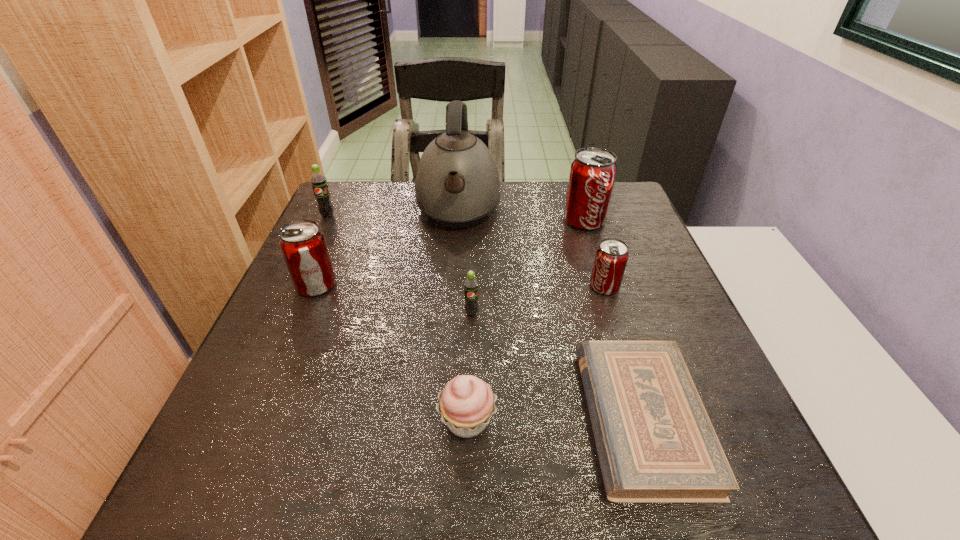
Identify the location of pink cupcake. (466, 404).

Locate an element on the screen. Bible is located at coordinates (655, 442).

You are a GUI agent. You are given a task and a screenshot of the screen. Output one action in this format:
    pyautogui.click(x=<x>, y=<y>)
    Task: Click on the blue Bible
    Image resolution: width=960 pixels, height=540 pixels.
    Given the screenshot: What is the action you would take?
    pyautogui.click(x=655, y=442)

I want to click on vacant space situated at the spout of the kettle, so (x=453, y=284).

What are the coordinates of `vacant space located 0.140m on the back of the tallest soda` in the screenshot? It's located at (573, 185).

I want to click on vacant region located on the front label of the bigger green soda, so click(x=279, y=319).

Identify the location of vacant space located on the back of the leftmost red pop soda. (339, 232).

The image size is (960, 540). What are the coordinates of `free location located 0.290m on the back of the smallest red pop soda` in the screenshot? It's located at (581, 211).

This screenshot has height=540, width=960. In order to click on vacant space situated 0.300m on the front label of the nearest soda in this screenshot , I will do `click(469, 451)`.

Identify the location of vacant space positioned on the back of the cupcake. (470, 296).